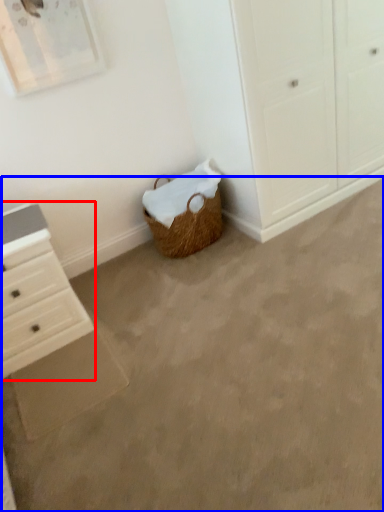
Question: Which object is closer to the camera taking this photo, chest of drawers (highlighted by a red box) or concrete (highlighted by a blue box)?

Choices:
 (A) chest of drawers
 (B) concrete

Answer: (B)